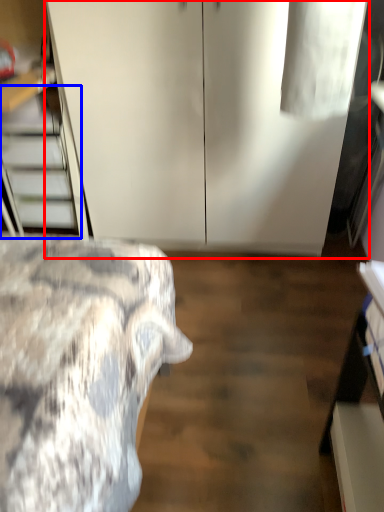
Question: Which of the following is the closest to the observer, dresser (highlighted by a red box) or stairwell (highlighted by a blue box)?

Choices:
 (A) dresser
 (B) stairwell

Answer: (A)